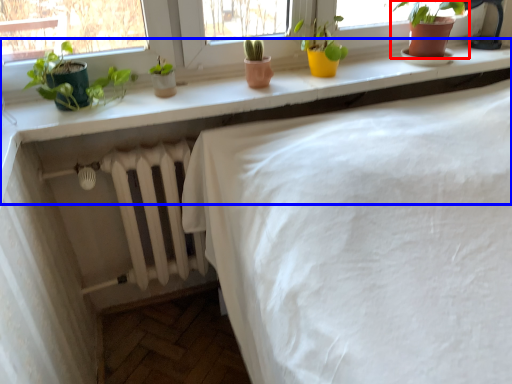
Question: Among these objects, which one is farthest to the camera, houseplant (highlighted by a red box) or counter (highlighted by a blue box)?

Choices:
 (A) houseplant
 (B) counter

Answer: (A)